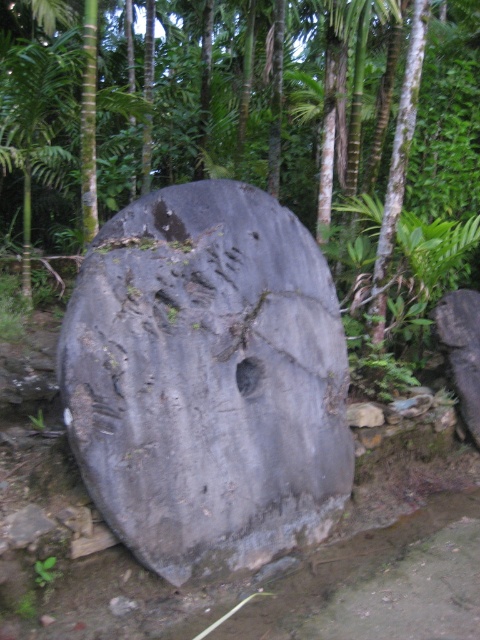
Question: Which point is closer to the camera taking this photo?

Choices:
 (A) (398, 33)
 (B) (160, 490)

Answer: (B)

Question: Is gray stone wheel at center further to the viewer compared to gray rough stone at center?

Choices:
 (A) yes
 (B) no

Answer: (A)

Question: Among these points, which one is nearest to the camera?

Choices:
 (A) (334, 339)
 (B) (41, 227)

Answer: (A)

Question: Does gray stone wheel at center have a greater width compared to gray rough stone at center?

Choices:
 (A) no
 (B) yes

Answer: (A)

Question: Observing the image, what is the correct spatial positioning of gray stone wheel at center in reference to gray rough stone at center?

Choices:
 (A) left
 (B) right

Answer: (B)